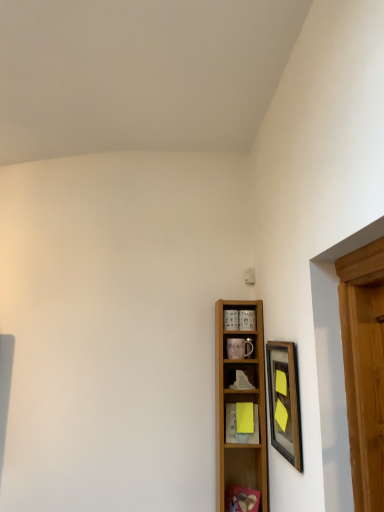
Where is `wooden shelf at center, the first shelf in the top-to-bottom sequence`? This screenshot has width=384, height=512. wooden shelf at center, the first shelf in the top-to-bottom sequence is located at coordinates (240, 376).

Could you tell me if wooden shelf at center, the first shelf in the top-to-bottom sequence, is turned towards wooden shelf at center, the second shelf viewed from the top?

Yes.

Which is more distant, (245, 374) or (262, 433)?

Positioned behind is point (245, 374).

Where is `the 2nd shelf in front of the wooden shelf at center, the third shelf ordered from the bottom`? the 2nd shelf in front of the wooden shelf at center, the third shelf ordered from the bottom is located at coordinates (240, 400).

Does wooden shelf at center, the first shelf in the top-to-bottom sequence, appear on the left side of wooden shelf at center, the second shelf viewed from the top?

No.

Is yellow paper at center, which is the 1th shelf from bottom to top, turned away from wooden framed picture at right?

No, yellow paper at center, which is the 1th shelf from bottom to top, is not facing away from wooden framed picture at right.

Identify the location of picture frame in front of the yellow paper at center, which is the 1th shelf from bottom to top. The width and height of the screenshot is (384, 512). (284, 401).

Does point (254, 409) come behind point (287, 366)?

Yes, point (254, 409) is behind point (287, 366).

Can you confirm if wooden shelf at center, the second shelf viewed from the top, is shorter than yellow paper at center, the 3th shelf viewed from the top?

In fact, wooden shelf at center, the second shelf viewed from the top, may be taller than yellow paper at center, the 3th shelf viewed from the top.

Identify the location of shelf that is in front of the yellow paper at center, which is the 1th shelf from bottom to top. (240, 400).

Could you tell me if wooden shelf at center, placed as the second shelf when sorted from bottom to top, is turned towards yellow paper at center, which is the 1th shelf from bottom to top?

Yes, wooden shelf at center, placed as the second shelf when sorted from bottom to top, is turned towards yellow paper at center, which is the 1th shelf from bottom to top.

From the picture: Which of these two, wooden shelf at center, placed as the second shelf when sorted from bottom to top, or yellow paper at center, the 3th shelf viewed from the top, is thinner?

Thinner between the two is yellow paper at center, the 3th shelf viewed from the top.

From a real-world perspective, is wooden shelf at center, the third shelf ordered from the bottom, over yellow paper at center, which is the 1th shelf from bottom to top?

Correct, in the physical world, wooden shelf at center, the third shelf ordered from the bottom, is higher than yellow paper at center, which is the 1th shelf from bottom to top.

From the image's perspective, is wooden shelf at center, the first shelf in the top-to-bottom sequence, on top of yellow paper at center, which is the 1th shelf from bottom to top?

Correct, wooden shelf at center, the first shelf in the top-to-bottom sequence, appears higher than yellow paper at center, which is the 1th shelf from bottom to top, in the image.

From a real-world perspective, who is located higher, yellow paper at center, which is the 1th shelf from bottom to top, or wooden shelf at center, the first shelf in the top-to-bottom sequence?

wooden shelf at center, the first shelf in the top-to-bottom sequence.

Is yellow paper at center, the 3th shelf viewed from the top, facing towards wooden shelf at center, the third shelf ordered from the bottom?

No.

From the image's perspective, is yellow paper at center, the 3th shelf viewed from the top, below wooden shelf at center, the first shelf in the top-to-bottom sequence?

Yes.

Consider the image. Are yellow paper at center, the 3th shelf viewed from the top, and wooden shelf at center, the first shelf in the top-to-bottom sequence, beside each other?

They are not placed beside each other.

Between wooden shelf at center, the second shelf viewed from the top, and wooden framed picture at right, which one has less height?

Standing shorter between the two is wooden framed picture at right.

Considering the positions of objects wooden shelf at center, placed as the second shelf when sorted from bottom to top, and wooden framed picture at right in the image provided, who is behind, wooden shelf at center, placed as the second shelf when sorted from bottom to top, or wooden framed picture at right?

Positioned behind is wooden shelf at center, placed as the second shelf when sorted from bottom to top.

Between wooden shelf at center, the second shelf viewed from the top, and wooden framed picture at right, which one has smaller size?

With smaller size is wooden framed picture at right.

Find the location of a particular element. This screenshot has width=384, height=512. the 3rd shelf counting from the left of the wooden framed picture at right is located at coordinates (240, 400).

Is point (274, 415) closer or farther from the camera than point (220, 428)?

Point (274, 415) is closer to the camera than point (220, 428).

Would you say wooden framed picture at right is to the left or to the right of wooden shelf at center, the second shelf viewed from the top, in the picture?

wooden framed picture at right is positioned on wooden shelf at center, the second shelf viewed from the top,'s right side.

Is there a large distance between wooden framed picture at right and wooden shelf at center, placed as the second shelf when sorted from bottom to top?

No, wooden framed picture at right is not far away from wooden shelf at center, placed as the second shelf when sorted from bottom to top.

From a real-world perspective, is wooden framed picture at right over wooden shelf at center, the second shelf viewed from the top?

Yes, from a real-world perspective, wooden framed picture at right is over wooden shelf at center, the second shelf viewed from the top

Which shelf is the 2nd one when counting from the front of the wooden shelf at center, the third shelf ordered from the bottom? Please provide its 2D coordinates.

[(240, 400)]

What are the coordinates of `picture frame that is on the right side of yellow paper at center, which is the 1th shelf from bottom to top` in the screenshot? It's located at 284,401.

Estimate the real-world distances between objects in this image. Which object is closer to yellow paper at center, which is the 1th shelf from bottom to top, wooden framed picture at right or wooden shelf at center, placed as the second shelf when sorted from bottom to top?

wooden shelf at center, placed as the second shelf when sorted from bottom to top.

Which object lies further to the anchor point yellow paper at center, which is the 1th shelf from bottom to top, wooden shelf at center, the first shelf in the top-to-bottom sequence, or wooden framed picture at right?

Based on the image, wooden framed picture at right appears to be further to yellow paper at center, which is the 1th shelf from bottom to top.

From the image, which object appears to be farther from wooden shelf at center, the third shelf ordered from the bottom, wooden shelf at center, placed as the second shelf when sorted from bottom to top, or yellow paper at center, which is the 1th shelf from bottom to top?

wooden shelf at center, placed as the second shelf when sorted from bottom to top, is positioned further to the anchor wooden shelf at center, the third shelf ordered from the bottom.

Looking at the image, which one is located closer to wooden shelf at center, the first shelf in the top-to-bottom sequence, yellow paper at center, the 3th shelf viewed from the top, or wooden shelf at center, placed as the second shelf when sorted from bottom to top?

yellow paper at center, the 3th shelf viewed from the top, lies closer to wooden shelf at center, the first shelf in the top-to-bottom sequence, than the other object.

Looking at the image, which one is located closer to yellow paper at center, which is the 1th shelf from bottom to top, wooden shelf at center, placed as the second shelf when sorted from bottom to top, or wooden shelf at center, the third shelf ordered from the bottom?

wooden shelf at center, placed as the second shelf when sorted from bottom to top.

When comparing their distances from wooden framed picture at right, does yellow paper at center, the 3th shelf viewed from the top, or wooden shelf at center, the third shelf ordered from the bottom, seem further?

yellow paper at center, the 3th shelf viewed from the top, is further to wooden framed picture at right.

When comparing their distances from yellow paper at center, the 3th shelf viewed from the top, does wooden shelf at center, placed as the second shelf when sorted from bottom to top, or wooden framed picture at right seem closer?

wooden shelf at center, placed as the second shelf when sorted from bottom to top.

Estimate the real-world distances between objects in this image. Which object is further from wooden framed picture at right, wooden shelf at center, placed as the second shelf when sorted from bottom to top, or yellow paper at center, which is the 1th shelf from bottom to top?

yellow paper at center, which is the 1th shelf from bottom to top, is positioned further to the anchor wooden framed picture at right.

Where is `shelf between wooden framed picture at right and yellow paper at center, the 3th shelf viewed from the top, along the z-axis`? Image resolution: width=384 pixels, height=512 pixels. shelf between wooden framed picture at right and yellow paper at center, the 3th shelf viewed from the top, along the z-axis is located at coordinates tap(240, 400).

Locate an element on the screen. The image size is (384, 512). shelf between wooden shelf at center, the third shelf ordered from the bottom, and yellow paper at center, the 3th shelf viewed from the top, from top to bottom is located at coordinates (240, 400).